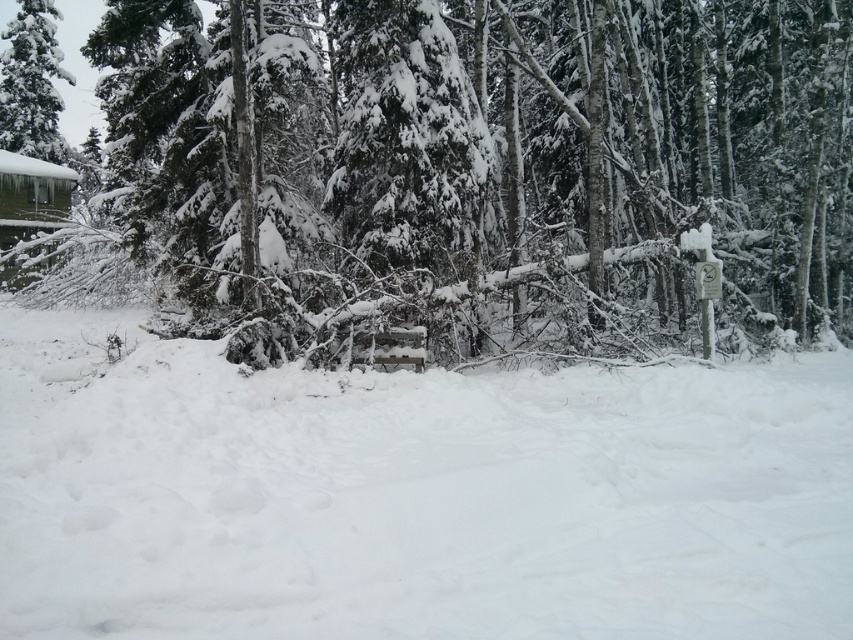
Does white fluffy snow at center have a smaller size compared to snow-covered evergreen tree at upper left?

Correct, white fluffy snow at center occupies less space than snow-covered evergreen tree at upper left.

Who is more forward, (288, 429) or (15, 140)?

Point (288, 429) is more forward.

Between point (33, 340) and point (45, 138), which one is positioned behind?

The point (45, 138) is behind.

Find the location of a particular element. white fluffy snow at center is located at coordinates pyautogui.click(x=415, y=497).

Does snow-covered evergreen at center have a lesser width compared to white fluffy snow at center?

In fact, snow-covered evergreen at center might be wider than white fluffy snow at center.

Which is more to the left, snow-covered evergreen at center or white fluffy snow at center?

snow-covered evergreen at center

Image resolution: width=853 pixels, height=640 pixels. Describe the element at coordinates (473, 166) in the screenshot. I see `snow-covered evergreen at center` at that location.

What are the coordinates of `snow-covered evergreen at center` in the screenshot? It's located at (473, 166).

Is snow-covered evergreen at center shorter than snow-covered evergreen tree at upper left?

In fact, snow-covered evergreen at center may be taller than snow-covered evergreen tree at upper left.

Who is taller, snow-covered evergreen at center or snow-covered evergreen tree at upper left?

Standing taller between the two is snow-covered evergreen at center.

Which is in front, point (323, 83) or point (25, 113)?

Point (323, 83)

Locate an element on the screen. snow-covered evergreen at center is located at coordinates (473, 166).